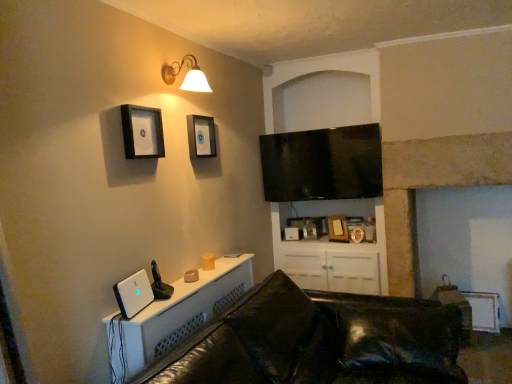
Question: Considering the positions of black matte picture frame at upper left, the third picture frame from the bottom, and black leather couch at lower center in the image, is black matte picture frame at upper left, the third picture frame from the bottom, taller or shorter than black leather couch at lower center?

Choices:
 (A) tall
 (B) short

Answer: (B)

Question: Considering the relative positions of black matte picture frame at upper left, which appears as the first picture frame when viewed from the left, and black leather couch at lower center in the image provided, is black matte picture frame at upper left, which appears as the first picture frame when viewed from the left, to the left or to the right of black leather couch at lower center?

Choices:
 (A) right
 (B) left

Answer: (B)

Question: Estimate the real-world distances between objects in this image. Which object is farther from the gold metallic picture frame at upper center, the fourth picture frame when ordered from top to bottom?

Choices:
 (A) matte black picture frame at upper center, the third picture frame viewed from the back
 (B) black leather couch at lower center
 (C) matte gold wall sconce at upper center
 (D) black glossy flat-screen tv at upper center
 (E) wooden picture frame at center, the 2th picture frame positioned from the right

Answer: (C)

Question: Based on their relative distances, which object is nearer to the white plastic desktop computer at lower left?

Choices:
 (A) white glossy cabinet at lower center
 (B) gold metallic picture frame at upper center, the second picture frame from the back
 (C) wooden picture frame at center, which is the 2th picture frame from bottom to top
 (D) black glossy flat-screen tv at upper center
 (E) matte black picture frame at upper center, the third picture frame viewed from the back

Answer: (A)